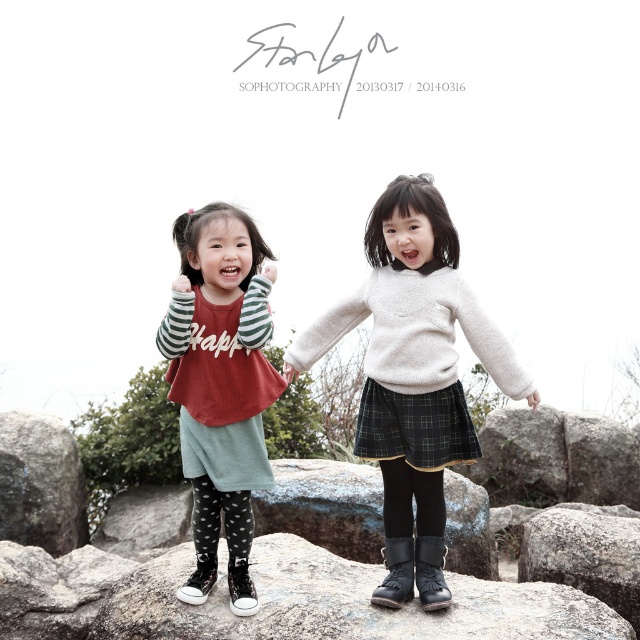
Can you confirm if shiny beige sweater at center is smaller than gray rough boulder at lower right?

No, shiny beige sweater at center is not smaller than gray rough boulder at lower right.

Is point (390, 216) closer to viewer compared to point (572, 509)?

Yes, point (390, 216) is closer to viewer.

Between point (435, 225) and point (561, 536), which one is positioned behind?

Point (561, 536)

Locate an element on the screen. The image size is (640, 640). shiny beige sweater at center is located at coordinates (413, 353).

Can you confirm if shiny beige sweater at center is positioned to the right of black rubber boot at lower center?

Indeed, shiny beige sweater at center is positioned on the right side of black rubber boot at lower center.

Does point (369, 284) lie in front of point (195, 586)?

No, it is not.

What are the coordinates of `shiny beige sweater at center` in the screenshot? It's located at (413, 353).

How much distance is there between green plaid skirt at center and black rubber boot at lower center?

green plaid skirt at center and black rubber boot at lower center are 1.81 meters apart.

What do you see at coordinates (416, 426) in the screenshot?
I see `green plaid skirt at center` at bounding box center [416, 426].

This screenshot has width=640, height=640. What do you see at coordinates (416, 426) in the screenshot?
I see `green plaid skirt at center` at bounding box center [416, 426].

This screenshot has width=640, height=640. I want to click on green plaid skirt at center, so click(x=416, y=426).